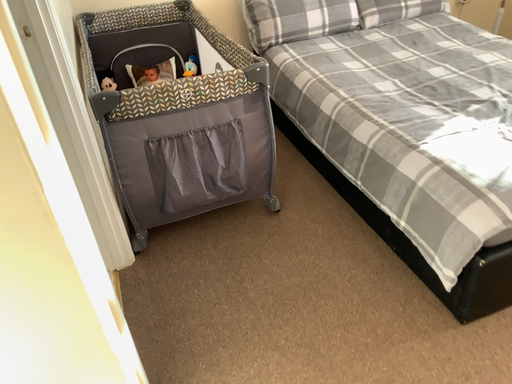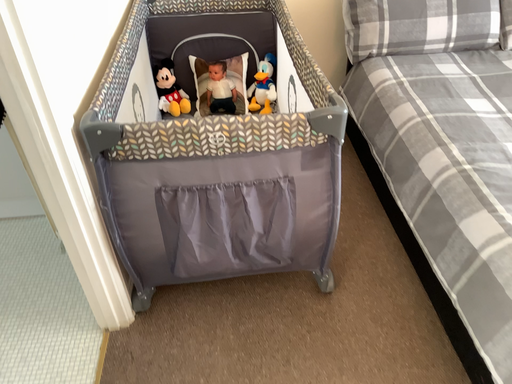
Question: How did the camera likely rotate when shooting the video?

Choices:
 (A) rotated left
 (B) rotated right

Answer: (A)